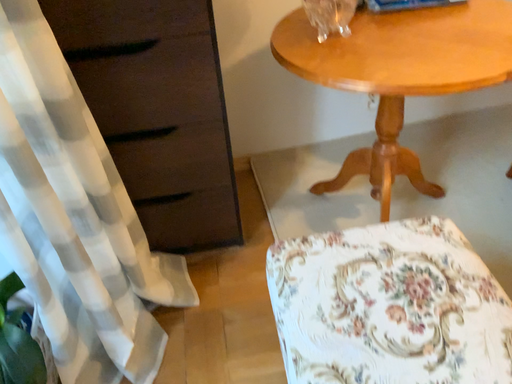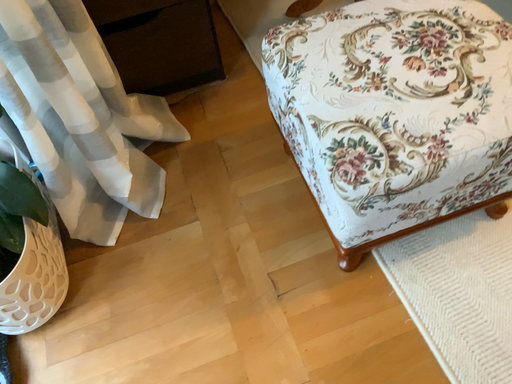
Question: How did the camera likely rotate when shooting the video?

Choices:
 (A) rotated downward
 (B) rotated upward

Answer: (A)